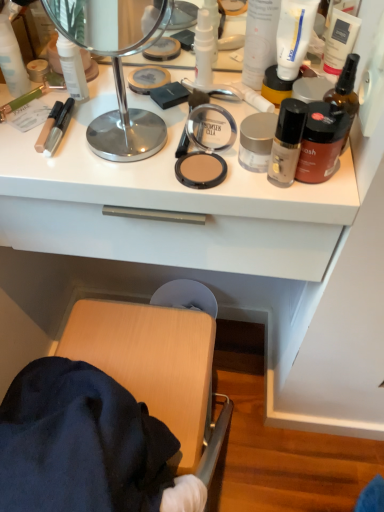
You are a GUI agent. You are given a task and a screenshot of the screen. Output one action in this format:
    pyautogui.click(x=<x>, y=<y>)
    Task: Click on the free space to the left of polished silver mirror at upper center
    Image resolution: width=384 pixels, height=512 pixels.
    Given the screenshot: What is the action you would take?
    pyautogui.click(x=40, y=137)